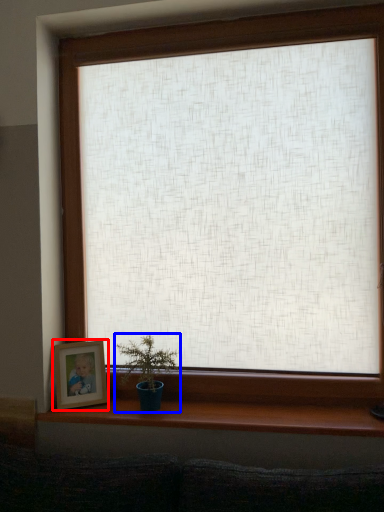
Question: Which object is further to the camera taking this photo, picture frame (highlighted by a red box) or houseplant (highlighted by a blue box)?

Choices:
 (A) picture frame
 (B) houseplant

Answer: (A)